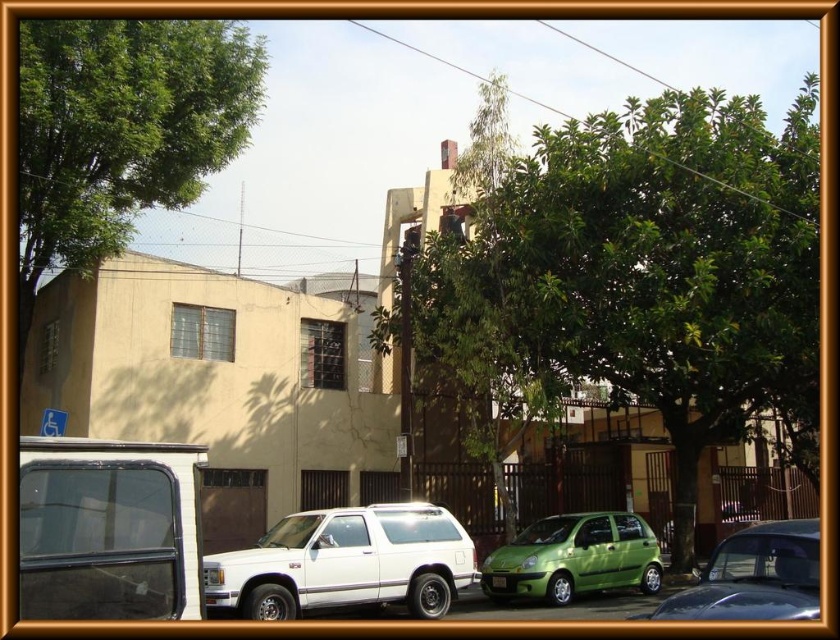
The image size is (840, 640). Describe the element at coordinates (122, 131) in the screenshot. I see `green leafy tree at upper left` at that location.

Can you confirm if green leafy tree at upper left is bigger than matte black van at lower left?

Indeed, green leafy tree at upper left has a larger size compared to matte black van at lower left.

Is point (239, 29) farther from camera compared to point (88, 474)?

Yes, it is behind point (88, 474).

Find the location of a particular element. green leafy tree at upper left is located at coordinates (122, 131).

From the picture: Does green leafy tree at center have a greater width compared to green leafy tree at upper left?

Indeed, green leafy tree at center has a greater width compared to green leafy tree at upper left.

In the scene shown: Is green leafy tree at center bigger than green leafy tree at upper left?

Indeed, green leafy tree at center has a larger size compared to green leafy tree at upper left.

Is point (583, 262) positioned after point (50, 77)?

That is True.

Locate an element on the screen. green leafy tree at center is located at coordinates (631, 273).

Is green leafy tree at upper left to the right of green matte hatchback at lower right from the viewer's perspective?

Incorrect, green leafy tree at upper left is not on the right side of green matte hatchback at lower right.

Does green leafy tree at upper left have a lesser height compared to green matte hatchback at lower right?

No, green leafy tree at upper left is not shorter than green matte hatchback at lower right.

What do you see at coordinates (122, 131) in the screenshot? The height and width of the screenshot is (640, 840). I see `green leafy tree at upper left` at bounding box center [122, 131].

Locate an element on the screen. This screenshot has width=840, height=640. green leafy tree at upper left is located at coordinates (122, 131).